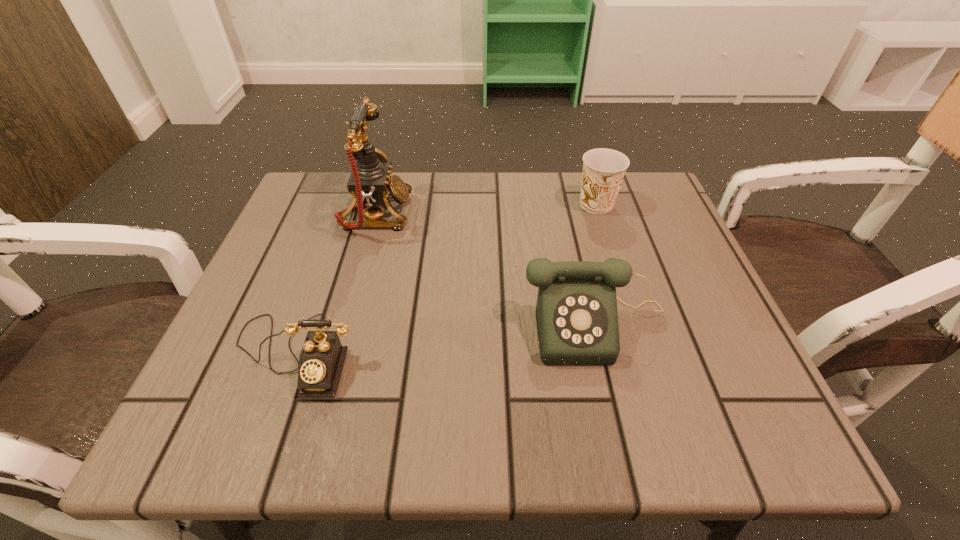
Where is `object that is at the near edge`? object that is at the near edge is located at coordinates (322, 357).

Locate an element on the screen. This screenshot has width=960, height=540. telephone that is at the right edge is located at coordinates (576, 312).

Find the location of `Dixie cup that is positioned at the right edge`. Dixie cup that is positioned at the right edge is located at coordinates (603, 169).

Where is `object that is positioned at the far left corner`? The width and height of the screenshot is (960, 540). object that is positioned at the far left corner is located at coordinates (370, 183).

Identify the location of object that is positioned at the near left corner. (322, 357).

Where is `object located at the far right corner`? object located at the far right corner is located at coordinates (603, 169).

The image size is (960, 540). In order to click on free space at the far edge of the desktop in this screenshot , I will do `click(505, 174)`.

The height and width of the screenshot is (540, 960). I want to click on vacant area at the near edge of the desktop, so [323, 403].

In the image, there is a desktop. Find the location of `vacant space at the left edge`. vacant space at the left edge is located at coordinates (231, 373).

Find the location of a particular element. Image resolution: width=960 pixels, height=540 pixels. vacant space at the right edge of the desktop is located at coordinates tap(671, 268).